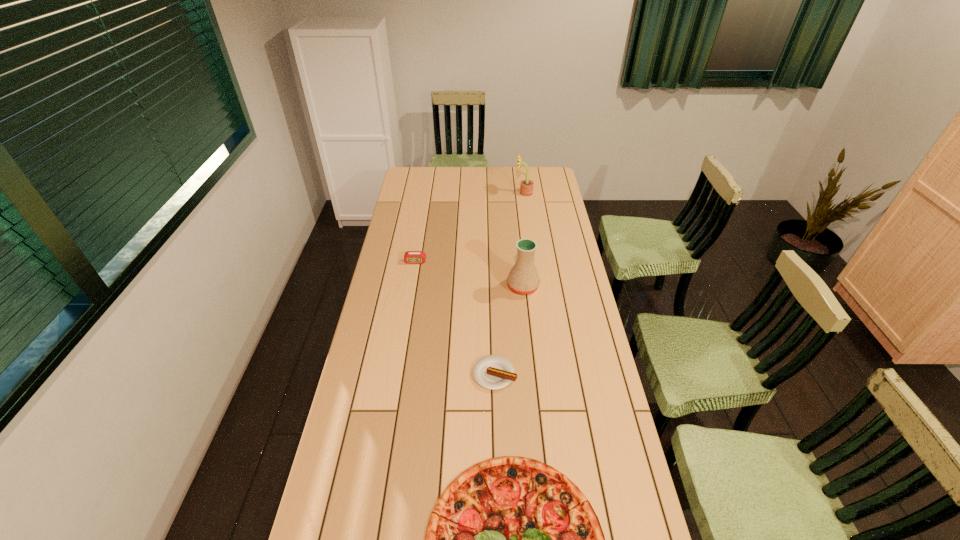
In order to click on the farthest object in this screenshot , I will do `click(526, 188)`.

This screenshot has width=960, height=540. Find the location of `pottery`. pottery is located at coordinates (523, 278).

Where is `the third shortest object`? The height and width of the screenshot is (540, 960). the third shortest object is located at coordinates (411, 257).

The image size is (960, 540). Identify the location of alarm clock. tap(411, 257).

You are a GUI agent. You are given a task and a screenshot of the screen. Output one action in this format:
    pyautogui.click(x=<x>, y=<y>)
    Task: Click on the fourth tallest object
    This screenshot has width=960, height=540.
    Given the screenshot: What is the action you would take?
    pyautogui.click(x=493, y=372)

Where is `the second nearest object`? This screenshot has width=960, height=540. the second nearest object is located at coordinates (493, 372).

At what (x,y) coordinates should I click in order to perform the action: click on vacant region located on the face of the sunflower. Please return your answer as a coordinate pair (x, y). This screenshot has width=960, height=540. Looking at the image, I should click on (495, 193).

Locate an element on the screen. vacant space positioned on the face of the sunflower is located at coordinates (447, 193).

Locate an element on the screen. This screenshot has width=960, height=540. vacant region located 0.270m on the face of the sunflower is located at coordinates coord(463,193).

Where is `vacant region located 0.250m on the back of the pottery`? The width and height of the screenshot is (960, 540). vacant region located 0.250m on the back of the pottery is located at coordinates (518, 239).